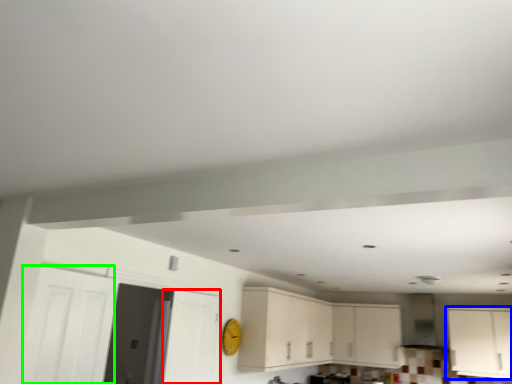
Question: Which object is positioned closest to door (highlighted by a red box)? Select from cabinetry (highlighted by a blue box) and door (highlighted by a green box).

Choices:
 (A) cabinetry
 (B) door

Answer: (B)